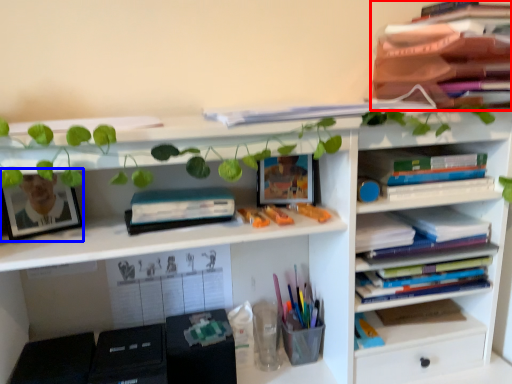
Question: Among these objects, which one is nearest to the camera, book (highlighted by a red box) or picture frame (highlighted by a blue box)?

Choices:
 (A) book
 (B) picture frame

Answer: (A)